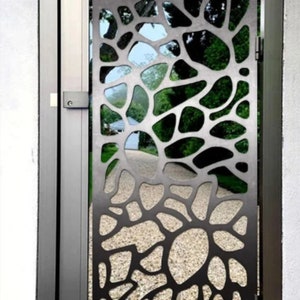
At what (x,y) coordinates should I click in order to perform the action: click on hinge. Please return your answer as a coordinate pair (x, y). Looking at the image, I should click on (257, 47).